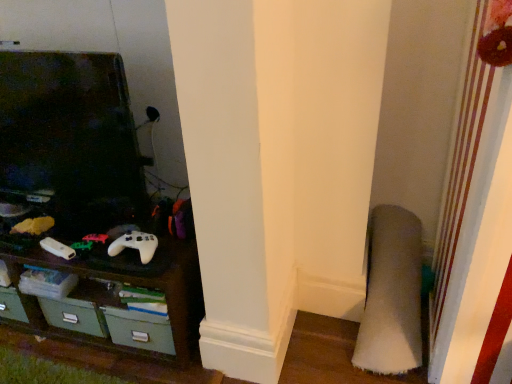
Image resolution: width=512 pixels, height=384 pixels. What do you see at coordinates (391, 294) in the screenshot?
I see `soft gray carpet at lower right` at bounding box center [391, 294].

Describe the element at coordinates (113, 300) in the screenshot. This screenshot has width=512, height=384. I see `dark wood shelf at lower left` at that location.

Describe the element at coordinates (57, 248) in the screenshot. I see `white matte game controller at lower left, the second game controller positioned from the right` at that location.

Locate an element on the screen. The image size is (512, 384). soft gray carpet at lower right is located at coordinates (391, 294).

How far apart are white matte game controller at lower left, the second game controller positioned from the right, and white matte game controller at center, which ranks as the 1th game controller in right-to-left order?

white matte game controller at lower left, the second game controller positioned from the right, and white matte game controller at center, which ranks as the 1th game controller in right-to-left order, are 23.13 centimeters apart.

Is white matte game controller at lower left, arranged as the 1th game controller when viewed from the left, turned away from white matte game controller at center, the second game controller from the left?

No.

Is white matte game controller at lower left, the second game controller positioned from the right, beside white matte game controller at center, the second game controller from the left?

No, white matte game controller at lower left, the second game controller positioned from the right, is not next to white matte game controller at center, the second game controller from the left.

Who is bigger, white matte game controller at lower left, arranged as the 1th game controller when viewed from the left, or white matte game controller at center, the second game controller from the left?

white matte game controller at center, the second game controller from the left, is bigger.

In the scene shown: From the image's perspective, would you say white matte game controller at center, the second game controller from the left, is positioned over dark wood shelf at lower left?

Yes, from the image's perspective, white matte game controller at center, the second game controller from the left, is above dark wood shelf at lower left.

Considering the sizes of objects white matte game controller at center, which ranks as the 1th game controller in right-to-left order, and dark wood shelf at lower left in the image provided, who is bigger, white matte game controller at center, which ranks as the 1th game controller in right-to-left order, or dark wood shelf at lower left?

Bigger between the two is dark wood shelf at lower left.

From a real-world perspective, which is physically below, white matte game controller at center, the second game controller from the left, or dark wood shelf at lower left?

dark wood shelf at lower left is physically lower.

From a real-world perspective, is white matte game controller at center, the second game controller from the left, below white matte game controller at lower left, the second game controller positioned from the right?

No, from a real-world perspective, white matte game controller at center, the second game controller from the left, is not under white matte game controller at lower left, the second game controller positioned from the right.

Are white matte game controller at center, which ranks as the 1th game controller in right-to-left order, and white matte game controller at lower left, the second game controller positioned from the right, far apart?

No, white matte game controller at center, which ranks as the 1th game controller in right-to-left order, is not far away from white matte game controller at lower left, the second game controller positioned from the right.

The height and width of the screenshot is (384, 512). In order to click on game controller on the left of white matte game controller at center, the second game controller from the left in this screenshot , I will do `click(57, 248)`.

Is point (125, 239) positioned behind point (63, 257)?

No, it is in front of (63, 257).

From the picture: Which object is closer to the camera, white matte game controller at lower left, arranged as the 1th game controller when viewed from the left, or dark wood shelf at lower left?

dark wood shelf at lower left.

Would you say white matte game controller at lower left, the second game controller positioned from the right, is to the left or to the right of dark wood shelf at lower left in the picture?

In the image, white matte game controller at lower left, the second game controller positioned from the right, appears on the right side of dark wood shelf at lower left.

From the image's perspective, is white matte game controller at lower left, arranged as the 1th game controller when viewed from the left, above dark wood shelf at lower left?

Yes, from the image's perspective, white matte game controller at lower left, arranged as the 1th game controller when viewed from the left, is over dark wood shelf at lower left.

Looking at this image, from a real-world perspective, is white matte game controller at center, the second game controller from the left, physically below soft gray carpet at lower right?

No.

Does white matte game controller at center, which ranks as the 1th game controller in right-to-left order, lie in front of soft gray carpet at lower right?

That is False.

Is point (141, 257) closer to viewer compared to point (394, 346)?

Yes, point (141, 257) is closer to viewer.

Would you say soft gray carpet at lower right is part of white matte game controller at center, the second game controller from the left,'s contents?

Definitely not — soft gray carpet at lower right is not inside white matte game controller at center, the second game controller from the left.

Is soft gray carpet at lower right placed right next to white matte game controller at lower left, arranged as the 1th game controller when viewed from the left?

soft gray carpet at lower right and white matte game controller at lower left, arranged as the 1th game controller when viewed from the left, are clearly separated.

Between soft gray carpet at lower right and white matte game controller at lower left, arranged as the 1th game controller when viewed from the left, which one is positioned behind?

white matte game controller at lower left, arranged as the 1th game controller when viewed from the left, is further from the camera.

Can you confirm if soft gray carpet at lower right is thinner than white matte game controller at lower left, arranged as the 1th game controller when viewed from the left?

In fact, soft gray carpet at lower right might be wider than white matte game controller at lower left, arranged as the 1th game controller when viewed from the left.

From the image's perspective, is soft gray carpet at lower right located above or below white matte game controller at lower left, the second game controller positioned from the right?

soft gray carpet at lower right is situated lower than white matte game controller at lower left, the second game controller positioned from the right, in the image.

In the scene shown: Is soft gray carpet at lower right next to dark wood shelf at lower left?

No, soft gray carpet at lower right is not in contact with dark wood shelf at lower left.

Consider the image. How far apart are soft gray carpet at lower right and dark wood shelf at lower left?

soft gray carpet at lower right and dark wood shelf at lower left are 31.44 inches apart.

Considering the relative positions of soft gray carpet at lower right and dark wood shelf at lower left in the image provided, is soft gray carpet at lower right behind dark wood shelf at lower left?

No.

Would you say soft gray carpet at lower right is outside dark wood shelf at lower left?

soft gray carpet at lower right is positioned outside dark wood shelf at lower left.

I want to click on game controller located above the white matte game controller at lower left, the second game controller positioned from the right (from a real-world perspective), so click(x=135, y=245).

This screenshot has height=384, width=512. What are the coordinates of `the 2nd game controller counting from the right of the dark wood shelf at lower left` in the screenshot? It's located at (135, 245).

When comparing their distances from white matte game controller at lower left, the second game controller positioned from the right, does soft gray carpet at lower right or dark wood shelf at lower left seem closer?

dark wood shelf at lower left is closer to white matte game controller at lower left, the second game controller positioned from the right.

Looking at the image, which one is located further to soft gray carpet at lower right, dark wood shelf at lower left or white matte game controller at center, which ranks as the 1th game controller in right-to-left order?

Among the two, white matte game controller at center, which ranks as the 1th game controller in right-to-left order, is located further to soft gray carpet at lower right.

Estimate the real-world distances between objects in this image. Which object is closer to soft gray carpet at lower right, white matte game controller at center, the second game controller from the left, or dark wood shelf at lower left?

dark wood shelf at lower left.

When comparing their distances from dark wood shelf at lower left, does white matte game controller at center, the second game controller from the left, or white matte game controller at lower left, the second game controller positioned from the right, seem closer?

white matte game controller at center, the second game controller from the left, is positioned closer to the anchor dark wood shelf at lower left.

When comparing their distances from white matte game controller at center, the second game controller from the left, does soft gray carpet at lower right or white matte game controller at lower left, arranged as the 1th game controller when viewed from the left, seem closer?

white matte game controller at lower left, arranged as the 1th game controller when viewed from the left, lies closer to white matte game controller at center, the second game controller from the left, than the other object.

Estimate the real-world distances between objects in this image. Which object is further from white matte game controller at center, the second game controller from the left, dark wood shelf at lower left or soft gray carpet at lower right?

soft gray carpet at lower right lies further to white matte game controller at center, the second game controller from the left, than the other object.

Looking at this image, considering their positions, is dark wood shelf at lower left positioned further to white matte game controller at center, which ranks as the 1th game controller in right-to-left order, than white matte game controller at lower left, arranged as the 1th game controller when viewed from the left?

dark wood shelf at lower left is positioned further to the anchor white matte game controller at center, which ranks as the 1th game controller in right-to-left order.

Consider the image. Considering their positions, is soft gray carpet at lower right positioned closer to dark wood shelf at lower left than white matte game controller at lower left, the second game controller positioned from the right?

Among the two, white matte game controller at lower left, the second game controller positioned from the right, is located nearer to dark wood shelf at lower left.

Locate an element on the screen. This screenshot has height=384, width=512. game controller located between white matte game controller at lower left, the second game controller positioned from the right, and soft gray carpet at lower right in the left-right direction is located at coordinates (135, 245).

Locate an element on the screen. game controller located between dark wood shelf at lower left and white matte game controller at center, which ranks as the 1th game controller in right-to-left order, in the left-right direction is located at coordinates (57, 248).